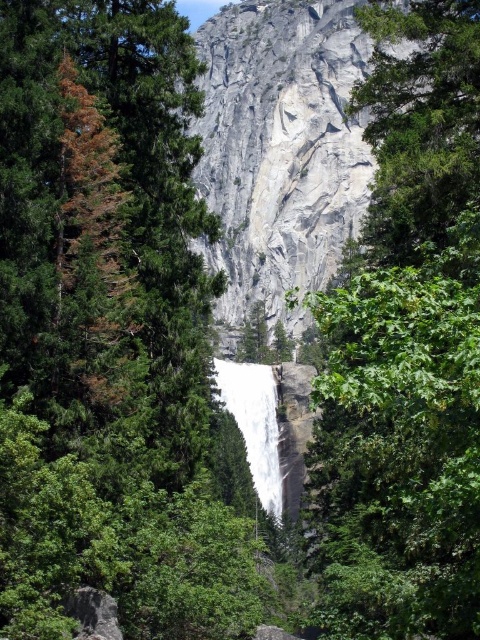
Question: Does green matte tree at center have a lesser width compared to green leafy tree at center?

Choices:
 (A) no
 (B) yes

Answer: (B)

Question: Is the position of gray/rough rock at center less distant than that of white smooth waterfall at center?

Choices:
 (A) no
 (B) yes

Answer: (B)

Question: Can you confirm if green matte tree at center is positioned above gray/rough rock at center?

Choices:
 (A) no
 (B) yes

Answer: (A)

Question: Which of the following is the closest to the observer?

Choices:
 (A) white smooth waterfall at center
 (B) green leafy tree at center
 (C) gray/rough rock at center
 (D) green matte tree at center

Answer: (B)

Question: Which object is the farthest from the white smooth waterfall at center?

Choices:
 (A) gray/rough rock at center
 (B) green leafy tree at center
 (C) green matte tree at center

Answer: (A)

Question: Which object is positioned closest to the gray/rough rock at center?

Choices:
 (A) green leafy tree at center
 (B) green matte tree at center
 (C) white smooth waterfall at center

Answer: (A)